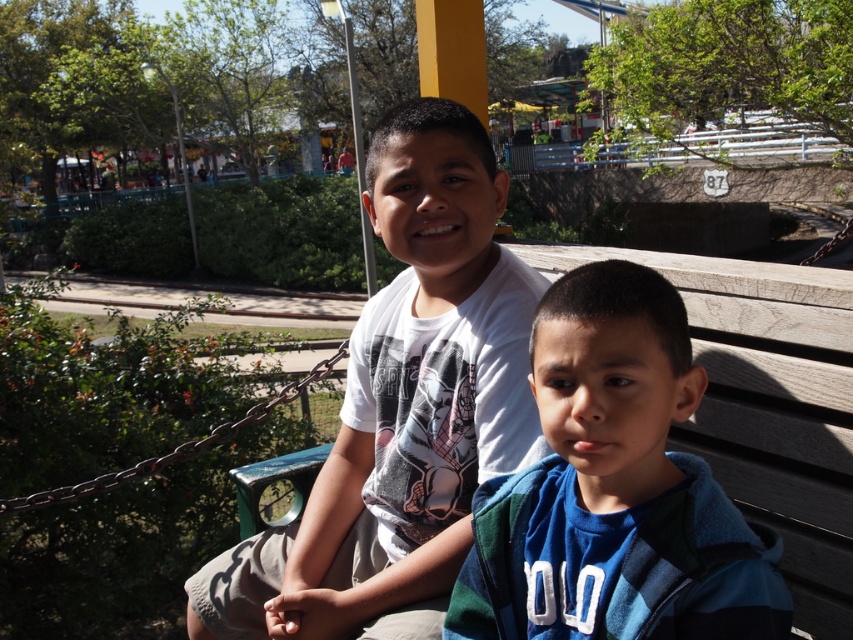
Question: Does white cotton shirt at center appear over blue fleece jacket at center?

Choices:
 (A) no
 (B) yes

Answer: (B)

Question: Is the position of white cotton shirt at center less distant than that of blue fleece jacket at center?

Choices:
 (A) yes
 (B) no

Answer: (B)

Question: Which of the following is the closest to the observer?

Choices:
 (A) (469, 445)
 (B) (723, 502)

Answer: (B)

Question: Considering the relative positions of white cotton shirt at center and blue fleece jacket at center in the image provided, where is white cotton shirt at center located with respect to blue fleece jacket at center?

Choices:
 (A) below
 (B) above

Answer: (B)

Question: Which point appears farthest from the camera in this image?

Choices:
 (A) (358, 497)
 (B) (700, 536)

Answer: (A)